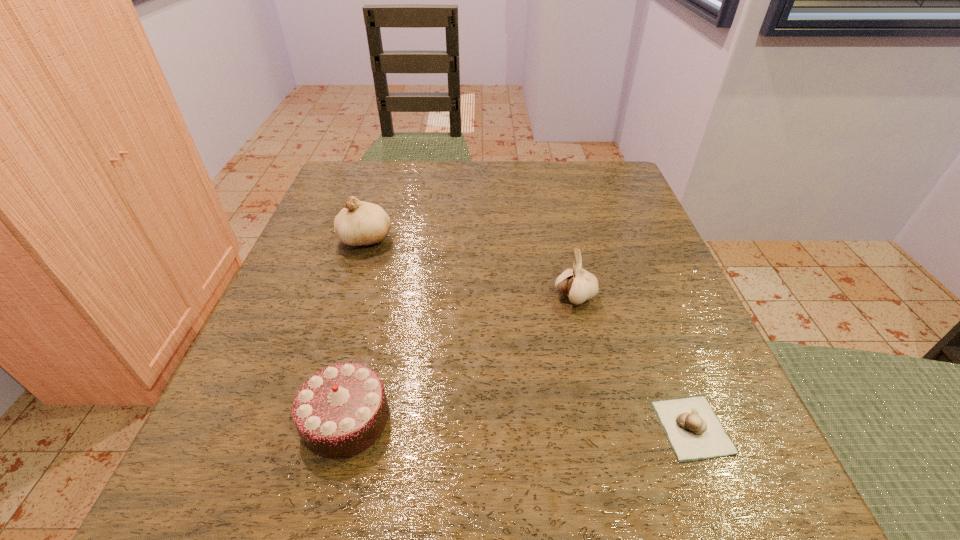
At what (x,y) coordinates should I click in order to perform the action: click on the leftmost garlic. Please return your answer as a coordinate pair (x, y). Image resolution: width=960 pixels, height=540 pixels. Looking at the image, I should click on (360, 223).

Where is `the farthest garlic`? The image size is (960, 540). the farthest garlic is located at coordinates (360, 223).

Find the location of a particular element. This screenshot has height=540, width=960. the second farthest garlic is located at coordinates (579, 285).

Where is `the second garlic from left to right`? the second garlic from left to right is located at coordinates (579, 285).

Identify the location of chocolate cake. This screenshot has width=960, height=540. (340, 411).

Identify the location of the nearest garlic. (694, 431).

Where is `the shortest object`? the shortest object is located at coordinates (694, 431).

I want to click on free space located 0.380m on the right of the leftmost garlic, so click(579, 239).

You are a GUI agent. You are given a task and a screenshot of the screen. Output one action in this format:
    pyautogui.click(x=<x>, y=<y>)
    Task: Click on the free spot located on the right of the third nearest object
    
    Given the screenshot: What is the action you would take?
    pyautogui.click(x=624, y=297)

Identify the location of vacant area located on the back of the chocolate cake. (376, 296).